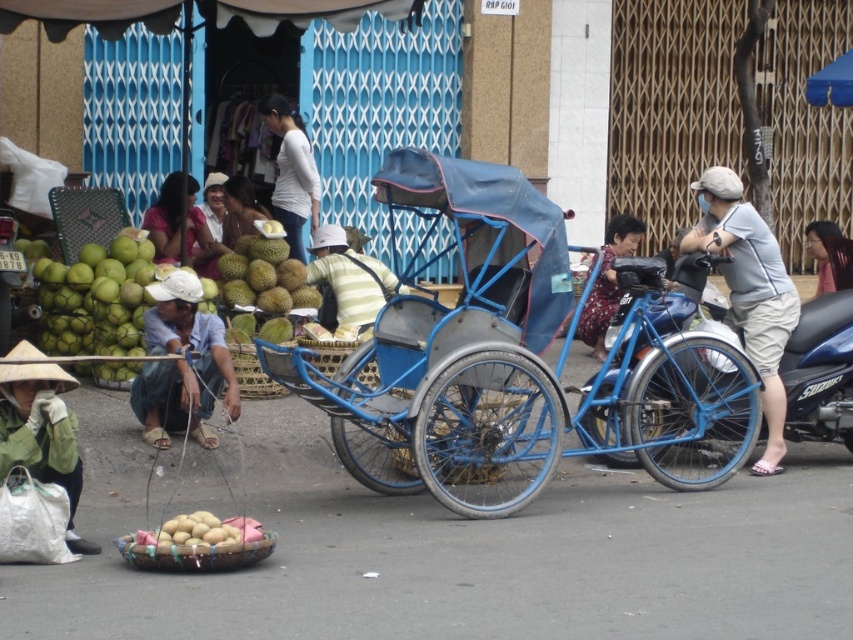
What object is located at the point with coordinates (511,358) in the image?

The point with coordinates (511,358) corresponds to the blue metallic rickshaw at center.

You are a customer in this Southeast Asian street scene. You see a light gray fabric shirt at center right and a white matte durian at center. Which item is taller?

The light gray fabric shirt at center right is taller than the white matte durian at center.